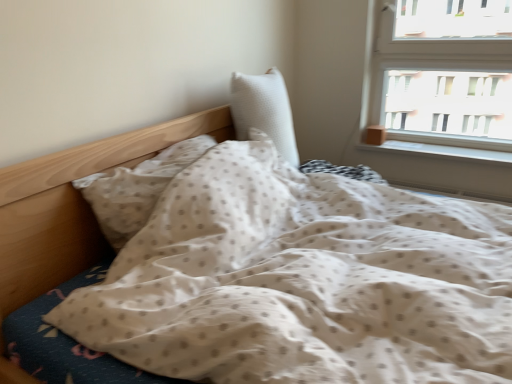
Locate an element on the screen. The height and width of the screenshot is (384, 512). empty space that is ontop of white smooth window sill at right (from a real-world perspective) is located at coordinates (432, 145).